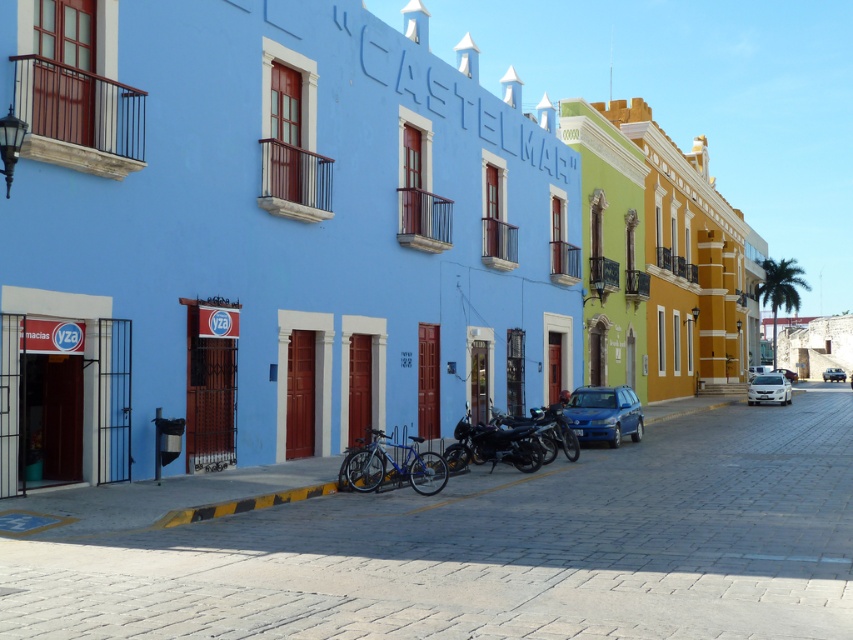
Does point (634, 394) come farther from viewer compared to point (788, 380)?

No, (634, 394) is in front of (788, 380).

You are a GUI agent. You are given a task and a screenshot of the screen. Output one action in this format:
    pyautogui.click(x=<x>, y=<y>)
    Task: Click on the matte blue car at center
    
    Given the screenshot: What is the action you would take?
    pyautogui.click(x=605, y=413)

Is metallic silver car at right further to camera compared to shiny blue sedan at center?

Yes, metallic silver car at right is further from the viewer.

Is point (837, 376) closer to camera compared to point (851, 371)?

Yes, it is.

I want to click on metallic silver car at right, so tap(833, 374).

Between matte blue car at center and shiny blue sedan at center, which one is positioned higher?

matte blue car at center is above.

Does matte blue car at center have a lesser height compared to shiny blue sedan at center?

Yes, matte blue car at center is shorter than shiny blue sedan at center.

Where is `matte blue car at center`? The height and width of the screenshot is (640, 853). matte blue car at center is located at coordinates (605, 413).

This screenshot has height=640, width=853. Identify the location of matte blue car at center. (605, 413).